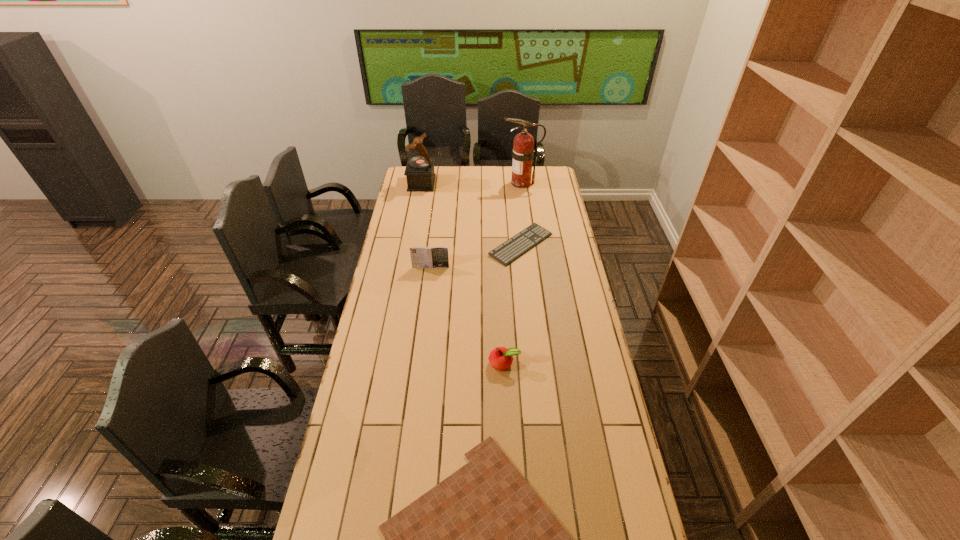
Where is `vacant region between the fifth tallest object and the fourth shortest object`? This screenshot has width=960, height=540. vacant region between the fifth tallest object and the fourth shortest object is located at coordinates (476, 256).

Where is `free area in between the fire extinguisher and the fourth tallest object`? The height and width of the screenshot is (540, 960). free area in between the fire extinguisher and the fourth tallest object is located at coordinates (513, 273).

Identify which object is located as the fourth nearest to the second tallest object. Please provide its 2D coordinates. Your answer should be formatted as a tuple, i.e. [(x, y)], where the tuple contains the x and y coordinates of a point satisfying the conditions above.

[(500, 358)]

Locate which object is the closest to the gameboard. Please provide its 2D coordinates. Your answer should be formatted as a tuple, i.e. [(x, y)], where the tuple contains the x and y coordinates of a point satisfying the conditions above.

[(500, 358)]

I want to click on vacant area that satisfies the following two spatial constraints: 1. on the back side of the second shortest object; 2. at the horn opening of the second tallest object, so click(515, 183).

Where is `free location that satisfies the following two spatial constraints: 1. at the nozzle of the fire extinguisher; 2. on the front cover of the fourth shortest object`? This screenshot has height=540, width=960. free location that satisfies the following two spatial constraints: 1. at the nozzle of the fire extinguisher; 2. on the front cover of the fourth shortest object is located at coordinates (532, 267).

Locate an element on the screen. vacant position in the image that satisfies the following two spatial constraints: 1. at the nozzle of the tallest object; 2. on the front side of the computer keyboard is located at coordinates (529, 245).

This screenshot has height=540, width=960. I want to click on free space that satisfies the following two spatial constraints: 1. at the horn opening of the fifth farthest object; 2. on the left side of the phonograph_record, so click(389, 363).

You are a GUI agent. You are given a task and a screenshot of the screen. Output one action in this format:
    pyautogui.click(x=<x>, y=<y>)
    Task: Click on the free spot that satisfies the following two spatial constraints: 1. at the horn opening of the phonograph_record; 2. on the left side of the second shortest object
    
    Given the screenshot: What is the action you would take?
    pyautogui.click(x=411, y=245)